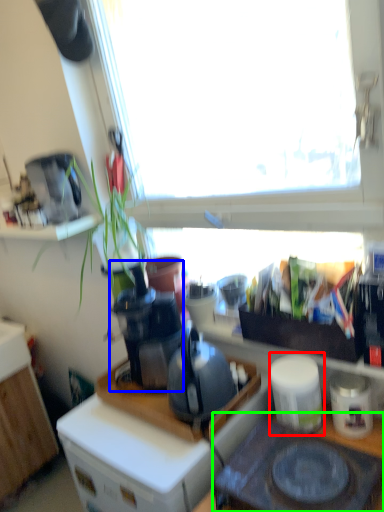
Question: Considering the real-world distances, which object is closest to appliance (highlighted by a red box)? coffee machine (highlighted by a blue box) or gas stove (highlighted by a green box).

Choices:
 (A) coffee machine
 (B) gas stove

Answer: (B)